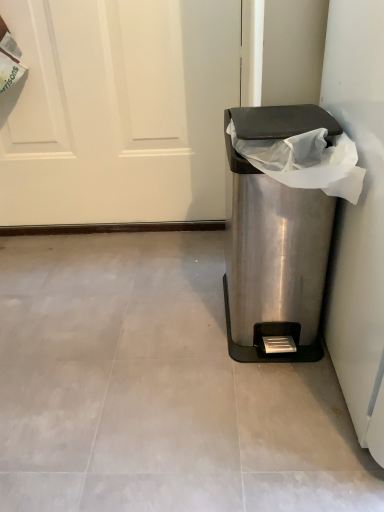
What do you see at coordinates (275, 242) in the screenshot? Image resolution: width=384 pixels, height=512 pixels. I see `satin silver trash can at right` at bounding box center [275, 242].

Where is `satin silver trash can at right`? The image size is (384, 512). satin silver trash can at right is located at coordinates (275, 242).

You are a GUI agent. You are given a task and a screenshot of the screen. Output one action in this format:
    pyautogui.click(x=<x>, y=<y>)
    Task: Click on the satin silver trash can at right
    
    Given the screenshot: What is the action you would take?
    pyautogui.click(x=275, y=242)